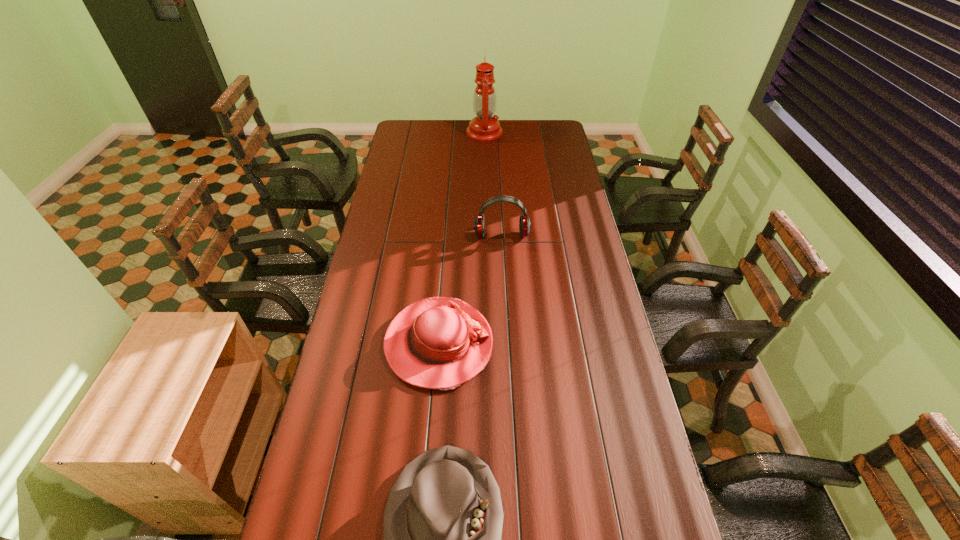
Find the location of a particular element. The width and height of the screenshot is (960, 540). blank area in the image that satisfies the following two spatial constraints: 1. on the ear cups of the second tallest object; 2. at the front of the third farthest object with a bow is located at coordinates (508, 344).